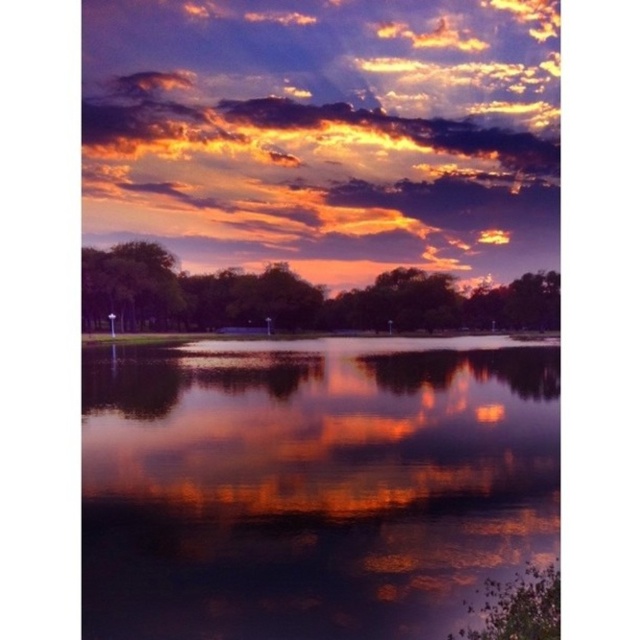
Question: Is glossy reflective water at center smaller than shiny orange cloud at upper center?

Choices:
 (A) yes
 (B) no

Answer: (A)

Question: Which point appears farthest from the camera in this image?

Choices:
 (A) (160, 67)
 (B) (106, 355)

Answer: (A)

Question: Considering the relative positions of glossy reflective water at center and shiny orange cloud at upper center in the image provided, where is glossy reflective water at center located with respect to shiny orange cloud at upper center?

Choices:
 (A) right
 (B) left

Answer: (B)

Question: Does glossy reflective water at center appear over shiny orange cloud at upper center?

Choices:
 (A) no
 (B) yes

Answer: (A)

Question: Among these objects, which one is nearest to the camera?

Choices:
 (A) glossy reflective water at center
 (B) shiny orange cloud at upper center

Answer: (A)